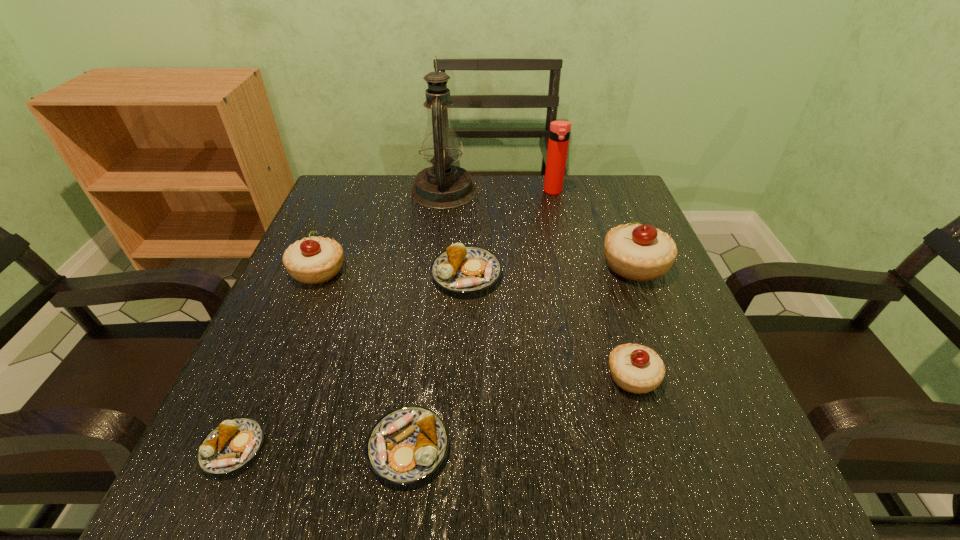
This screenshot has height=540, width=960. What are the coordinates of `vacant space situated 0.260m on the right of the second shortest pastry` in the screenshot? It's located at (626, 448).

The width and height of the screenshot is (960, 540). What are the coordinates of `vacant area located 0.230m on the right of the smallest brown pastry` in the screenshot? It's located at (420, 449).

You are a GUI agent. You are given a task and a screenshot of the screen. Output one action in this format:
    pyautogui.click(x=<x>, y=<y>)
    Task: Click on the oil lamp present at the far edge
    This screenshot has width=960, height=540.
    Given the screenshot: What is the action you would take?
    [x=442, y=186]

Find the location of `thermos bottle that is at the far edge`. thermos bottle that is at the far edge is located at coordinates (559, 134).

This screenshot has width=960, height=540. I want to click on object that is at the near left corner, so click(x=234, y=443).

The image size is (960, 540). I want to click on free point at the far edge, so click(x=484, y=198).

Identify the location of vacant space at the near edge of the desktop. The image size is (960, 540). (641, 508).

This screenshot has height=540, width=960. In order to click on vacant space at the left edge of the desktop in this screenshot , I will do `click(372, 244)`.

Locate an element on the screen. The image size is (960, 540). vacant space at the right edge of the desktop is located at coordinates (586, 239).

At what (x,y) coordinates should I click in order to perform the action: click on empty location between the fourth tallest pastry and the second tallest object. Please return your answer as a coordinate pair (x, y). This screenshot has width=960, height=540. Looking at the image, I should click on (510, 233).